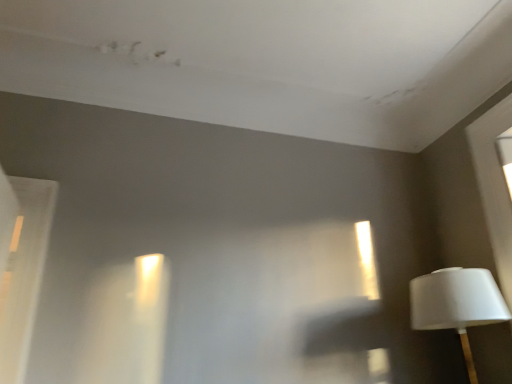
Describe the element at coordinates (24, 273) in the screenshot. I see `white glossy door at left` at that location.

At what (x,y) coordinates should I click in order to perform the action: click on white glossy door at left. Please return your answer as a coordinate pair (x, y). The height and width of the screenshot is (384, 512). Looking at the image, I should click on (24, 273).

In order to face white glossy door at left, should I rotate leftwards or rightwards?

It's best to rotate left around 33.205 degrees.

Describe the element at coordinates (457, 304) in the screenshot. I see `white matte lampshade at right` at that location.

What is the approximate width of white matte lampshade at right?

white matte lampshade at right is 19.07 inches wide.

This screenshot has width=512, height=384. Find the location of `white matte lampshade at right`. white matte lampshade at right is located at coordinates (457, 304).

What are the coordinates of `white glossy door at left` in the screenshot? It's located at (24, 273).

Which is more to the right, white matte lampshade at right or white glossy door at left?

From the viewer's perspective, white matte lampshade at right appears more on the right side.

Relative to white glossy door at left, is white matte lampshade at right in front or behind?

white matte lampshade at right is positioned farther from the viewer than white glossy door at left.

Between point (483, 291) and point (27, 213), which one is positioned in front?

The point (483, 291) is in front.

From the image's perspective, is white matte lampshade at right on white glossy door at left?

Actually, white matte lampshade at right appears below white glossy door at left in the image.

From a real-world perspective, is white matte lampshade at right located beneath white glossy door at left?

Yes, from a real-world perspective, white matte lampshade at right is below white glossy door at left.

Which object is wider, white matte lampshade at right or white glossy door at left?

white matte lampshade at right is wider.

Between white matte lampshade at right and white glossy door at left, which one has less height?

white matte lampshade at right.

Considering the relative sizes of white matte lampshade at right and white glossy door at left in the image provided, is white matte lampshade at right bigger than white glossy door at left?

Actually, white matte lampshade at right might be smaller than white glossy door at left.

Would you say white matte lampshade at right is inside or outside white glossy door at left?

white matte lampshade at right is not enclosed by white glossy door at left.

Would you consider white matte lampshade at right to be distant from white glossy door at left?

Yes, white matte lampshade at right is far from white glossy door at left.

Is white matte lampshade at right facing away from white glossy door at left?

That's not correct — white matte lampshade at right is not looking away from white glossy door at left.

Find the location of a particular element. This screenshot has width=512, height=384. lamp that appears below the white glossy door at left (from the image's perspective) is located at coordinates (457, 304).

Can you confirm if white glossy door at left is positioned to the left of white matte lampshade at right?

Yes.

Which object is further away from the camera taking this photo, white glossy door at left or white matte lampshade at right?

white matte lampshade at right is further from the camera.

Does point (44, 182) come in front of point (468, 313)?

No, it is behind (468, 313).

From the image's perspective, is white glossy door at left on top of white matte lampshade at right?

Yes.

From a real-world perspective, who is located lower, white glossy door at left or white matte lampshade at right?

white matte lampshade at right.

Is white glossy door at left thinner than white matte lampshade at right?

Indeed, white glossy door at left has a lesser width compared to white matte lampshade at right.

Does white glossy door at left have a greater height compared to white matte lampshade at right?

Yes, white glossy door at left is taller than white matte lampshade at right.

Based on their sizes in the image, would you say white glossy door at left is bigger or smaller than white matte lampshade at right?

In the image, white glossy door at left appears to be larger than white matte lampshade at right.

Consider the image. Is white glossy door at left not inside white matte lampshade at right?

white glossy door at left is positioned outside white matte lampshade at right.

Is white glossy door at left beside white matte lampshade at right?

There is a gap between white glossy door at left and white matte lampshade at right.

Is white glossy door at left oriented away from white matte lampshade at right?

Yes, white glossy door at left's orientation is away from white matte lampshade at right.

Can you tell me how much white glossy door at left and white matte lampshade at right differ in facing direction?

90.8 degrees separate the facing orientations of white glossy door at left and white matte lampshade at right.

In order to click on window that appears above the white matte lampshade at right (from a real-world perspective) in this screenshot , I will do `click(24, 273)`.

Where is `lamp lying on the right of white glossy door at left`? The height and width of the screenshot is (384, 512). lamp lying on the right of white glossy door at left is located at coordinates (457, 304).

This screenshot has height=384, width=512. In order to click on window in front of the white matte lampshade at right in this screenshot , I will do `click(24, 273)`.